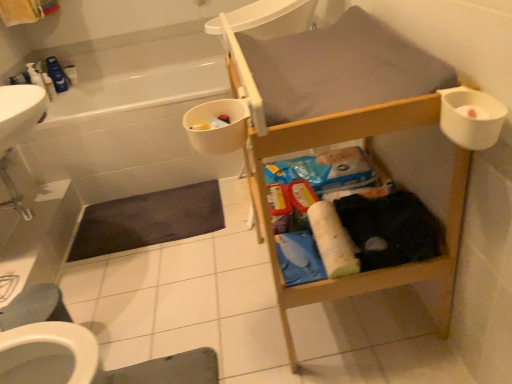
Question: Does white plastic bidet at lower left have a lesser height compared to white glossy bathtub at upper left?

Choices:
 (A) yes
 (B) no

Answer: (A)

Question: Is white plastic bidet at lower left far from white glossy bathtub at upper left?

Choices:
 (A) no
 (B) yes

Answer: (B)

Question: Is white plastic bidet at lower left to the right of white glossy bathtub at upper left from the viewer's perspective?

Choices:
 (A) yes
 (B) no

Answer: (B)

Question: Considering the relative sizes of white plastic bidet at lower left and white glossy bathtub at upper left in the image provided, is white plastic bidet at lower left bigger than white glossy bathtub at upper left?

Choices:
 (A) no
 (B) yes

Answer: (A)

Question: From a real-world perspective, is white plastic bidet at lower left on white glossy bathtub at upper left?

Choices:
 (A) no
 (B) yes

Answer: (A)

Question: From a real-world perspective, is white glossy bathtub at upper left above or below white plastic cup at upper right?

Choices:
 (A) below
 (B) above

Answer: (A)

Question: Visually, is white glossy bathtub at upper left positioned to the left or to the right of white plastic cup at upper right?

Choices:
 (A) left
 (B) right

Answer: (A)

Question: Is white glossy bathtub at upper left in front of or behind white plastic cup at upper right in the image?

Choices:
 (A) front
 (B) behind

Answer: (B)

Question: Does point (224, 165) appear closer or farther from the camera than point (444, 114)?

Choices:
 (A) farther
 (B) closer

Answer: (A)

Question: Would you say white plastic cup at upper right is inside or outside blue plastic container at upper left, the 3th toiletry viewed from the right?

Choices:
 (A) inside
 (B) outside

Answer: (B)

Question: Is point (465, 127) closer or farther from the camera than point (49, 97)?

Choices:
 (A) farther
 (B) closer

Answer: (B)

Question: From the image's perspective, is white plastic cup at upper right above or below blue plastic container at upper left, which is the second toiletry from front to back?

Choices:
 (A) below
 (B) above

Answer: (A)

Question: From a real-world perspective, is white plastic cup at upper right above or below blue plastic container at upper left, arranged as the second toiletry when viewed from the back?

Choices:
 (A) below
 (B) above

Answer: (B)

Question: Considering the positions of dark matte bath mat at lower left, the 2th bath mat when ordered from front to back, and white plastic bidet at lower left in the image, is dark matte bath mat at lower left, the 2th bath mat when ordered from front to back, bigger or smaller than white plastic bidet at lower left?

Choices:
 (A) big
 (B) small

Answer: (B)

Question: From the image's perspective, is dark matte bath mat at lower left, the first bath mat when ordered from top to bottom, above or below white plastic bidet at lower left?

Choices:
 (A) above
 (B) below

Answer: (A)